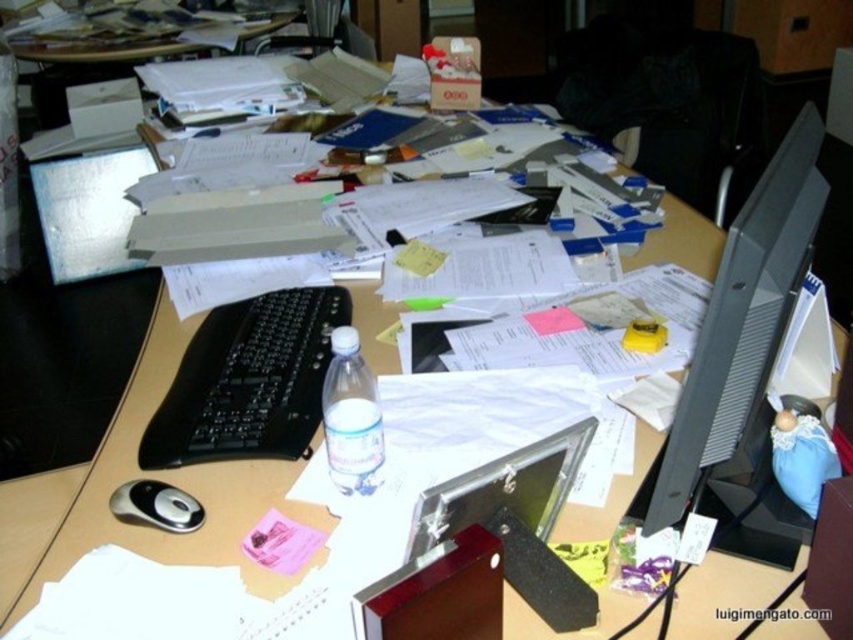
Is point (370, 449) positioned in front of point (276, 24)?

Yes, it is.

The width and height of the screenshot is (853, 640). What do you see at coordinates (351, 417) in the screenshot? I see `translucent plastic water bottle at center` at bounding box center [351, 417].

Where is `translucent plastic water bottle at center`? translucent plastic water bottle at center is located at coordinates (351, 417).

Is black glossy computer monitor at right smaller than black plastic mouse at lower left?

Actually, black glossy computer monitor at right might be larger than black plastic mouse at lower left.

Is black glossy computer monitor at right thinner than black plastic mouse at lower left?

No.

Between point (811, 173) and point (157, 484), which one is positioned behind?

Positioned behind is point (157, 484).

You are a GUI agent. You are given a task and a screenshot of the screen. Output one action in this format:
    pyautogui.click(x=<x>, y=<y>)
    Task: Click on the black glossy computer monitor at right
    This screenshot has width=853, height=640.
    Given the screenshot: What is the action you would take?
    pyautogui.click(x=743, y=368)

Who is taller, black glossy computer monitor at right or translucent plastic water bottle at center?

Standing taller between the two is black glossy computer monitor at right.

Between point (712, 355) and point (369, 435), which one is positioned behind?

Positioned behind is point (369, 435).

Image resolution: width=853 pixels, height=640 pixels. What do you see at coordinates (743, 368) in the screenshot?
I see `black glossy computer monitor at right` at bounding box center [743, 368].

Where is `black glossy computer monitor at right`? black glossy computer monitor at right is located at coordinates pos(743,368).